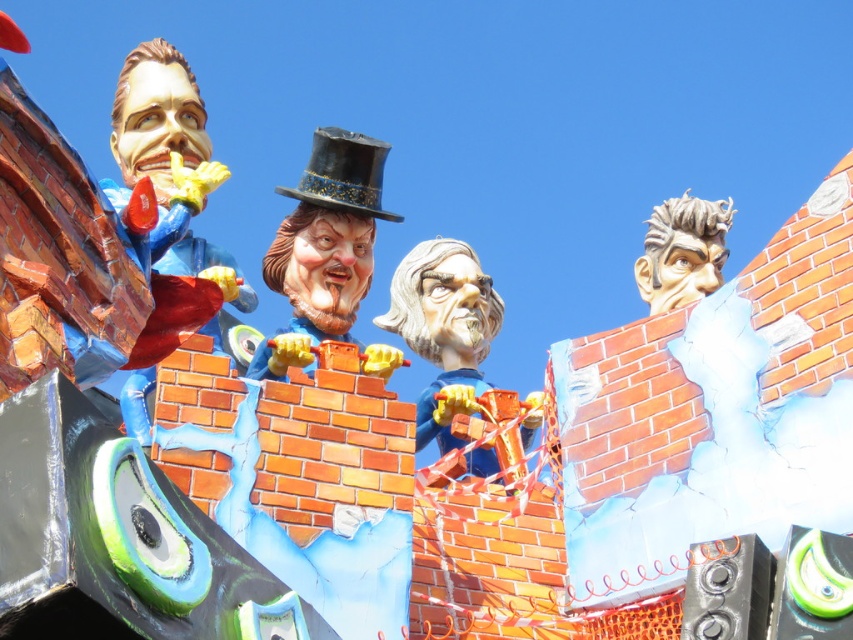
Question: Which of the following is the closest to the observer?

Choices:
 (A) shiny black dress hat at center
 (B) matte gold statue at center

Answer: (B)

Question: Does matte blue figure at center lie behind shiny black dress hat at center?

Choices:
 (A) no
 (B) yes

Answer: (A)

Question: Considering the real-world distances, which object is closest to the matte blue figure at center?

Choices:
 (A) shiny black dress hat at center
 (B) sculpted gray hair at upper right
 (C) matte gold statue at center

Answer: (C)

Question: Is matte blue figure at center behind shiny black dress hat at center?

Choices:
 (A) no
 (B) yes

Answer: (A)

Question: Does matte gold statue at center appear under matte blue figure at center?

Choices:
 (A) yes
 (B) no

Answer: (B)

Question: Which object is closer to the camera taking this photo?

Choices:
 (A) matte gold statue at center
 (B) matte blue figure at center
 (C) sculpted gray hair at upper right

Answer: (B)